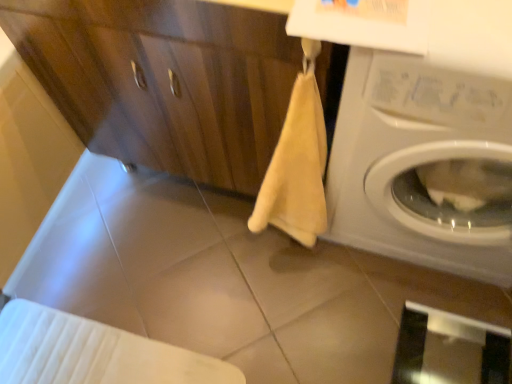
Identify the location of free point behind beige matte tile at center. (199, 232).